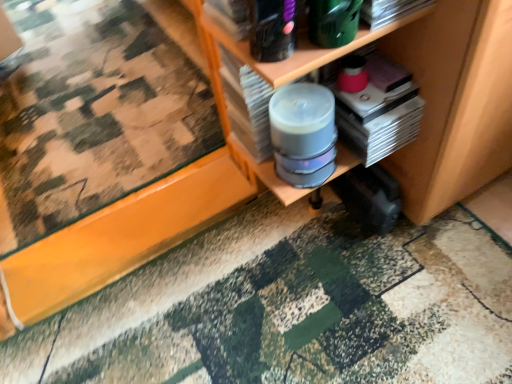
Describe the element at coordinates (455, 102) in the screenshot. I see `matte plastic cds at center` at that location.

What are the coordinates of `matte plastic cds at center` in the screenshot? It's located at (455, 102).

You are a GUI agent. You are given a task and a screenshot of the screen. Output one action in this format:
    pyautogui.click(x=<x>, y=<y>)
    Task: Click on the matte plastic cds at center
    
    Given the screenshot: What is the action you would take?
    pyautogui.click(x=455, y=102)